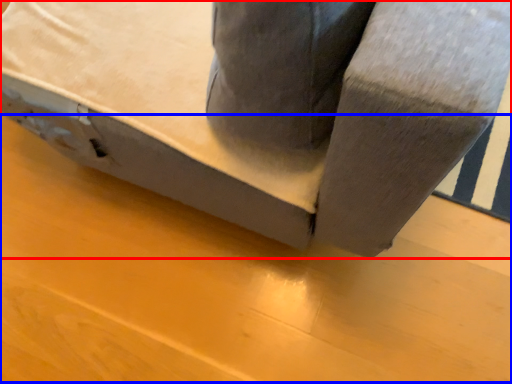
Question: Which object appears farthest to the camera in this image, furniture (highlighted by a red box) or plywood (highlighted by a blue box)?

Choices:
 (A) furniture
 (B) plywood

Answer: (B)